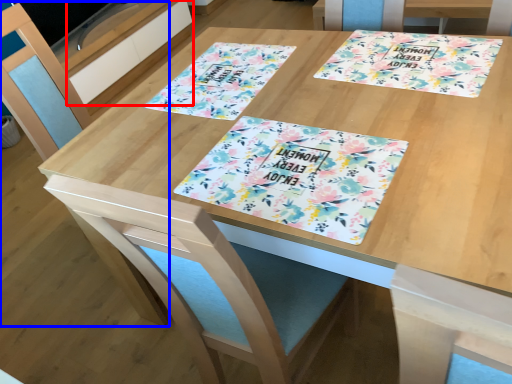
Question: Which point is closer to the camera, drawer (highlighted by a red box) or chair (highlighted by a blue box)?

Choices:
 (A) drawer
 (B) chair

Answer: (B)